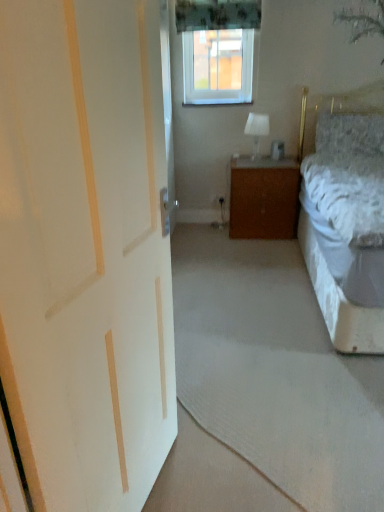
Question: Is point tap(248, 115) closer or farther from the camera than point tap(230, 53)?

Choices:
 (A) closer
 (B) farther

Answer: (A)

Question: Based on their sizes in the image, would you say white fabric lampshade at upper center is bigger or smaller than clear plastic window screen at upper center?

Choices:
 (A) small
 (B) big

Answer: (A)

Question: Based on their relative distances, which object is nearer to the fluffy gray pillow at upper right?

Choices:
 (A) white painted wood door at left
 (B) green floral fabric curtain at upper center
 (C) wooden cabinet at center
 (D) clear plastic window screen at upper center
 (E) white fabric lampshade at upper center

Answer: (C)

Question: Which object is the closest to the wooden cabinet at center?

Choices:
 (A) green floral fabric curtain at upper center
 (B) white painted wood door at left
 (C) fluffy gray pillow at upper right
 (D) white fabric lampshade at upper center
 (E) clear plastic window screen at upper center

Answer: (D)